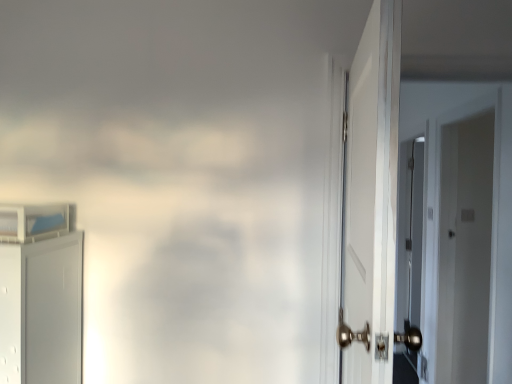
Question: Considering the positions of white glossy door at right, which ranks as the 2th door in left-to-right order, and white matte cabinet at left, the 1th door positioned from the left, in the image, is white glossy door at right, which ranks as the 2th door in left-to-right order, bigger or smaller than white matte cabinet at left, the 1th door positioned from the left,?

Choices:
 (A) big
 (B) small

Answer: (A)

Question: From the image's perspective, is white glossy door at right, the first door positioned from the right, above or below white matte cabinet at left, the 1th door positioned from the left?

Choices:
 (A) below
 (B) above

Answer: (B)

Question: From a real-world perspective, is white glossy door at right, which ranks as the 2th door in left-to-right order, positioned above or below white matte cabinet at left, the second door from the right?

Choices:
 (A) below
 (B) above

Answer: (B)

Question: From a real-world perspective, is white matte cabinet at left, the 1th door positioned from the left, positioned above or below white glossy door at right, which ranks as the 2th door in left-to-right order?

Choices:
 (A) below
 (B) above

Answer: (A)

Question: From their relative heights in the image, would you say white matte cabinet at left, the 1th door positioned from the left, is taller or shorter than white glossy door at right, the first door positioned from the right?

Choices:
 (A) short
 (B) tall

Answer: (A)

Question: Considering the relative positions of white matte cabinet at left, the 1th door positioned from the left, and white glossy door at right, which ranks as the 2th door in left-to-right order, in the image provided, is white matte cabinet at left, the 1th door positioned from the left, to the left or to the right of white glossy door at right, which ranks as the 2th door in left-to-right order,?

Choices:
 (A) right
 (B) left

Answer: (B)

Question: Is point (55, 311) positioned closer to the camera than point (467, 206)?

Choices:
 (A) closer
 (B) farther

Answer: (A)